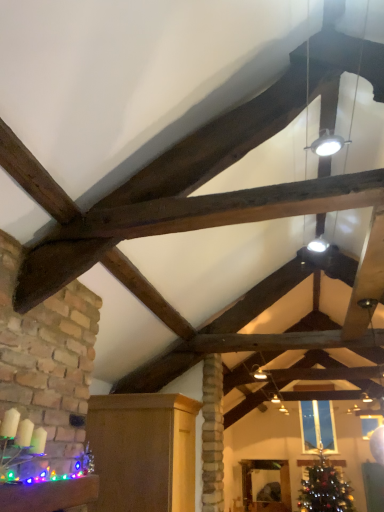
Question: Considering the positions of shiny green christmas tree at lower right and matte wood cabinet at lower left, which is the 2th furniture from top to bottom, in the image, is shiny green christmas tree at lower right wider or thinner than matte wood cabinet at lower left, which is the 2th furniture from top to bottom,?

Choices:
 (A) thin
 (B) wide

Answer: (B)

Question: Does point 314,468 appear closer or farther from the camera than point 157,457?

Choices:
 (A) closer
 (B) farther

Answer: (B)

Question: Considering the real-world distances, which object is closest to the matte wood cabinet at lower left, which is the 2th furniture in front-to-back order?

Choices:
 (A) wooden mirror at center, acting as the first furniture starting from the bottom
 (B) clear glass window at center
 (C) shiny green christmas tree at lower right
 (D) multicolored plastic garland at lower left, which is counted as the 3th furniture, starting from the bottom

Answer: (D)

Question: Which object is positioned closest to the clear glass window at center?

Choices:
 (A) shiny green christmas tree at lower right
 (B) matte wood cabinet at lower left, placed as the 2th furniture when sorted from bottom to top
 (C) wooden mirror at center, the third furniture when ordered from top to bottom
 (D) multicolored plastic garland at lower left, which is counted as the 3th furniture, starting from the right

Answer: (A)